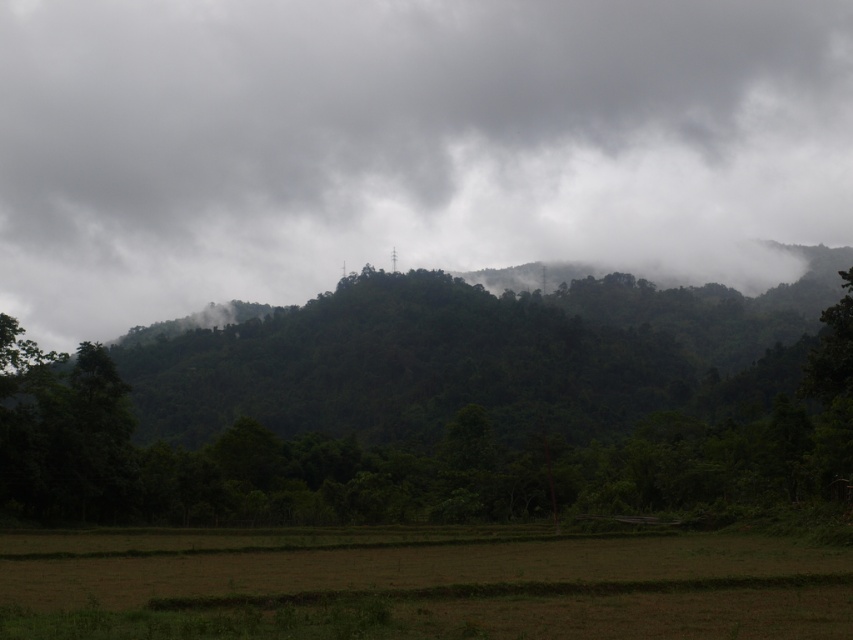
Is white fluffy cloud at upper center shorter than brown grassland at lower center?

No, white fluffy cloud at upper center is not shorter than brown grassland at lower center.

This screenshot has width=853, height=640. What do you see at coordinates (405, 147) in the screenshot?
I see `white fluffy cloud at upper center` at bounding box center [405, 147].

Where is `white fluffy cloud at upper center`? The image size is (853, 640). white fluffy cloud at upper center is located at coordinates (405, 147).

Is white fluffy cloud at upper center shorter than green leafy tree at center?

No, white fluffy cloud at upper center is not shorter than green leafy tree at center.

Who is lower down, white fluffy cloud at upper center or green leafy tree at center?

Positioned lower is green leafy tree at center.

Does point (704, 40) come farther from viewer compared to point (422, 480)?

Yes, point (704, 40) is farther from viewer.

Locate an element on the screen. The height and width of the screenshot is (640, 853). white fluffy cloud at upper center is located at coordinates (405, 147).

Can you confirm if green leafy tree at center is positioned to the left of brown grassland at lower center?

Correct, you'll find green leafy tree at center to the left of brown grassland at lower center.

Consider the image. Between green leafy tree at center and brown grassland at lower center, which one has less height?

With less height is brown grassland at lower center.

Who is more forward, (639, 362) or (625, 595)?

Positioned in front is point (625, 595).

Image resolution: width=853 pixels, height=640 pixels. I want to click on green leafy tree at center, so click(x=438, y=404).